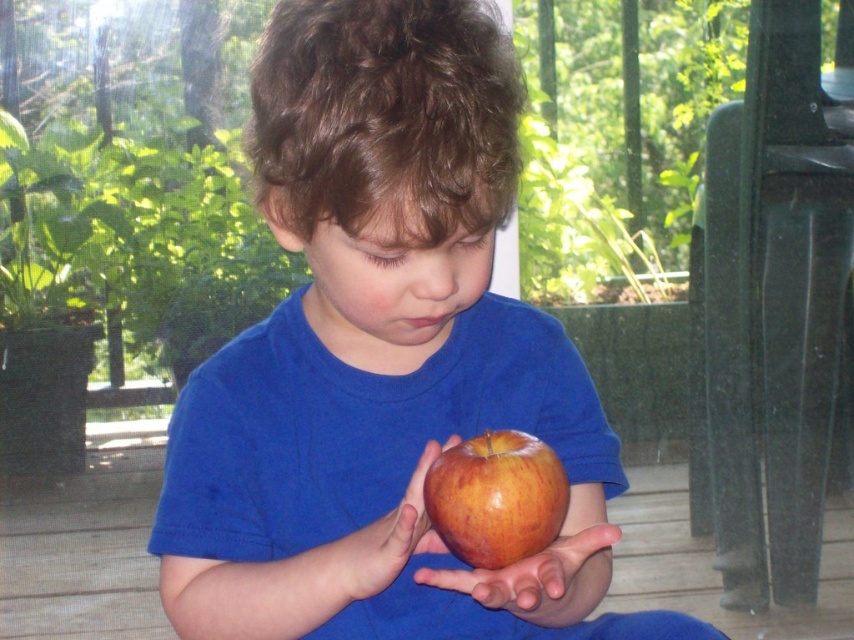
You are a parent trying to ensure your child doesn not choke on the shiny red apple at center. The child is holding the apple in their smooth skin palm at center. Based on the distance between the apple and the palm, can you determine if the apple is too small to pose a choking hazard?

The distance of 2.02 inches between the shiny red apple at center and the smooth skin palm at center indicates that the apple is smaller than the palm, so it may be a choking hazard. Please cut the apple into smaller pieces before giving it to the child.

You are a photographer standing at a distance. You want to take a closeup shot of the smooth skin palm at center. Based on the scene description, can you estimate whether you need to move closer or farther away from the subject to get a clear closeup?

The smooth skin palm at center is 23.12 inches from the viewer. To get a clear closeup, you would need to move closer since the current distance is more than the ideal closeup range for most cameras.

You are a fruit vendor who needs to arrange apples in a display. You have two apples, a matte red apple at center and a shiny red apple at center. The display requires apples to be spaced at least 15 centimeters apart for visibility. Can you place both apples in the display as per the requirement?

The distance between the matte red apple at center and the shiny red apple at center is 14.98 centimeters, which is less than the required 15 centimeters. Therefore, they cannot be placed in the display as per the requirement.